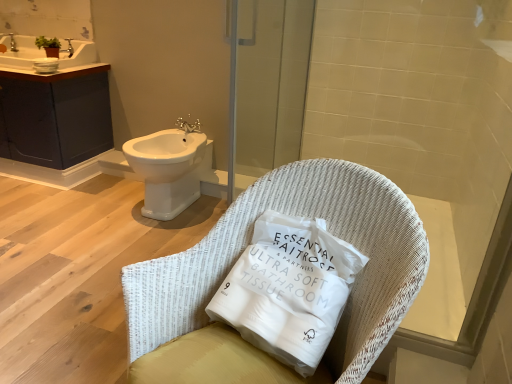
Question: Can you confirm if white wicker chair at center is taller than white woven pillow at center?

Choices:
 (A) no
 (B) yes

Answer: (B)

Question: Is white woven pillow at center located within white wicker chair at center?

Choices:
 (A) no
 (B) yes

Answer: (B)

Question: Is white wicker chair at center wider than white woven pillow at center?

Choices:
 (A) yes
 (B) no

Answer: (A)

Question: From a real-world perspective, is white wicker chair at center physically above white woven pillow at center?

Choices:
 (A) yes
 (B) no

Answer: (B)

Question: Is white wicker chair at center completely or partially outside of white woven pillow at center?

Choices:
 (A) no
 (B) yes

Answer: (B)

Question: Is white wicker chair at center to the left of white woven pillow at center from the viewer's perspective?

Choices:
 (A) yes
 (B) no

Answer: (A)

Question: Is white wicker chair at center wider than transparent glass screen door at upper center?

Choices:
 (A) yes
 (B) no

Answer: (A)

Question: Does white wicker chair at center have a greater height compared to transparent glass screen door at upper center?

Choices:
 (A) yes
 (B) no

Answer: (B)

Question: Can you confirm if white wicker chair at center is thinner than transparent glass screen door at upper center?

Choices:
 (A) no
 (B) yes

Answer: (A)

Question: Can you confirm if white wicker chair at center is bigger than transparent glass screen door at upper center?

Choices:
 (A) yes
 (B) no

Answer: (A)

Question: Does white wicker chair at center touch transparent glass screen door at upper center?

Choices:
 (A) yes
 (B) no

Answer: (B)

Question: Does white wicker chair at center appear on the left side of transparent glass screen door at upper center?

Choices:
 (A) no
 (B) yes

Answer: (A)

Question: Is silver metallic faucet at upper center closer to the viewer compared to transparent glass screen door at upper center?

Choices:
 (A) yes
 (B) no

Answer: (B)